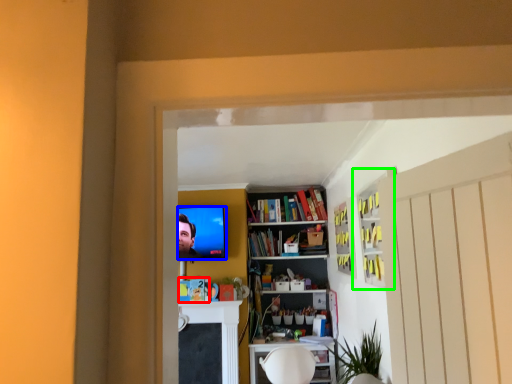
Question: Based on their relative distances, which object is nearer to book (highlighted by a red box)? Choose from television (highlighted by a blue box) and cabinet (highlighted by a green box).

Choices:
 (A) television
 (B) cabinet

Answer: (A)